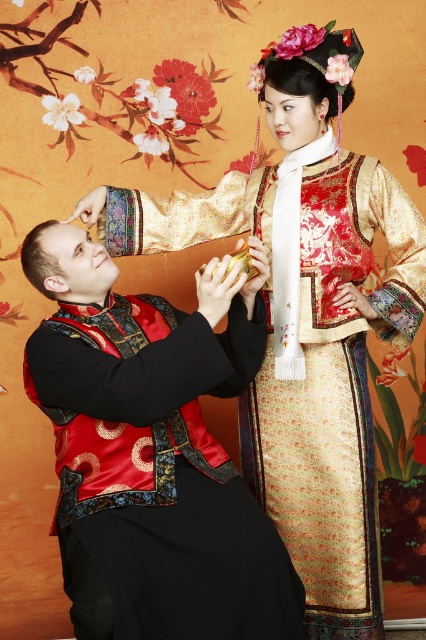
You are standing in front of the image and want to know how far the point at coordinates point (241, 552) is from you. Can you determine the distance?

The point (241, 552) is 5.49 feet away from the viewer.

You are observing two people in the image. The person on the left is wearing a satin black vest at center, and the person on the right is wearing a shiny gold brocade dress at center. Which clothing item is positioned lower on their respective bodies?

The satin black vest at center is below the shiny gold brocade dress at center, so the satin black vest at center is positioned lower on the person on the left compared to the shiny gold brocade dress at center on the person on the right.

You are taking a photo of two people in traditional Chinese attire. You notice two points in the image labeled as point [89,442] and point [313,141]. Which point will appear larger in your photo?

Point [89,442] is closer to the camera than point [313,141], so it will appear larger in the photo.